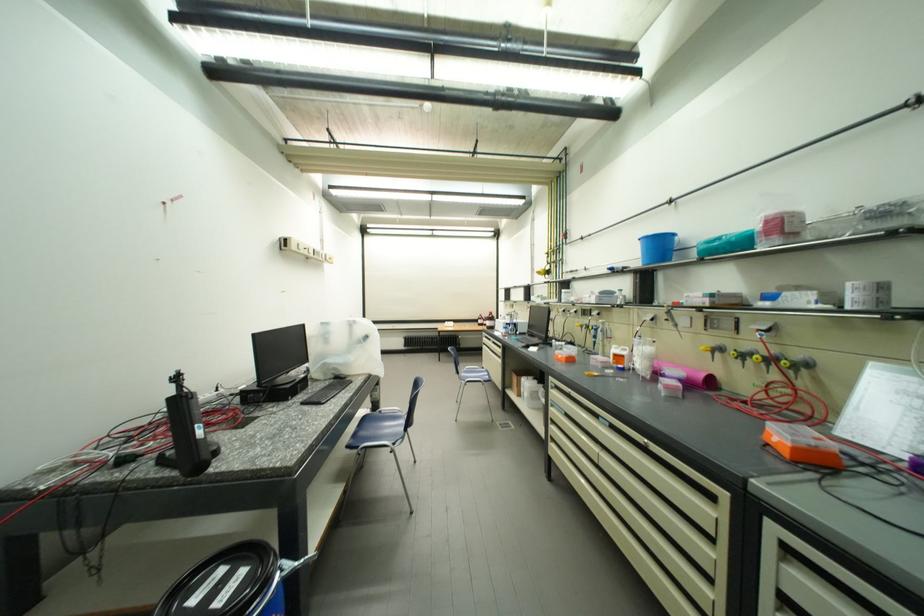
The image size is (924, 616). What do you see at coordinates (382, 427) in the screenshot? I see `a blue chair sitting surface` at bounding box center [382, 427].